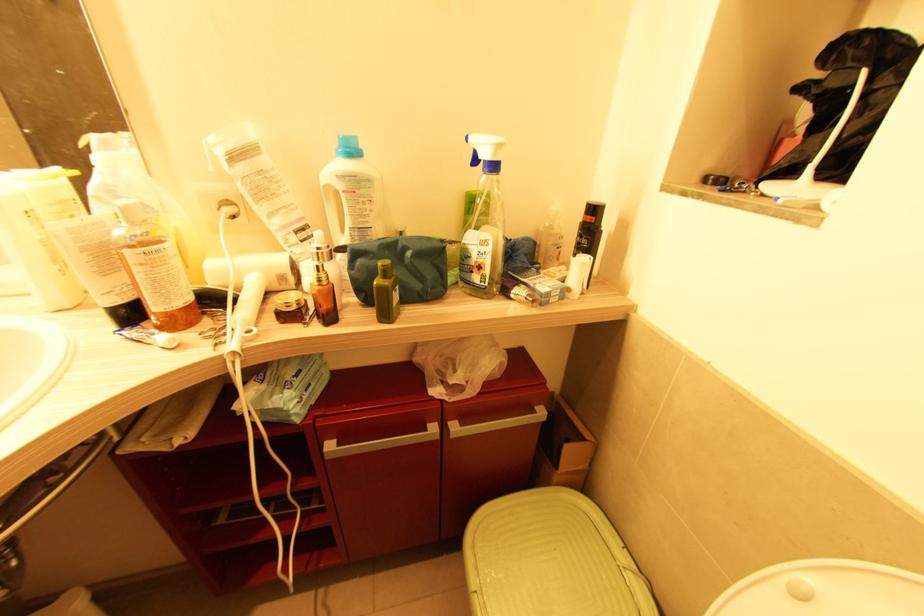
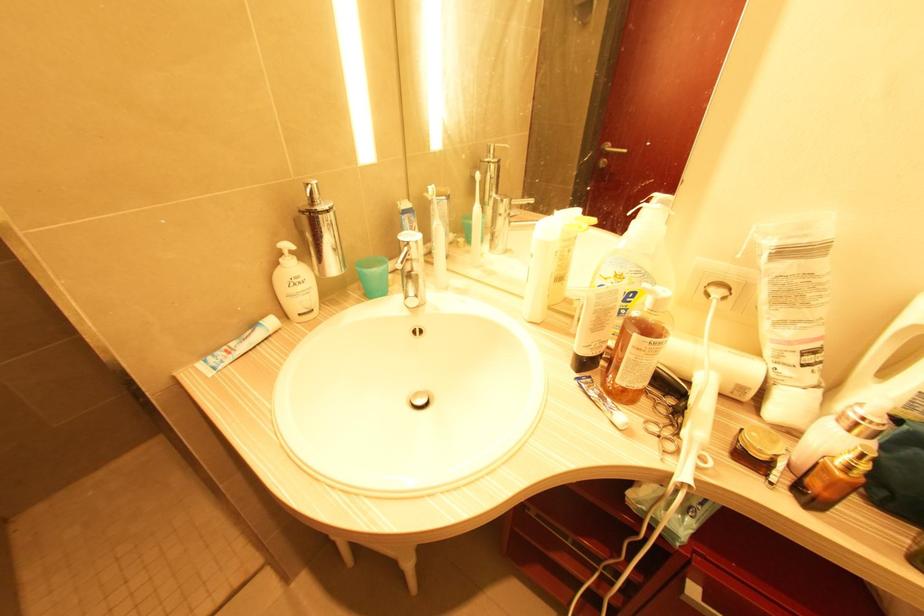
The point at (284,278) is marked in the first image. Where is the corresponding point in the second image?

(743, 390)